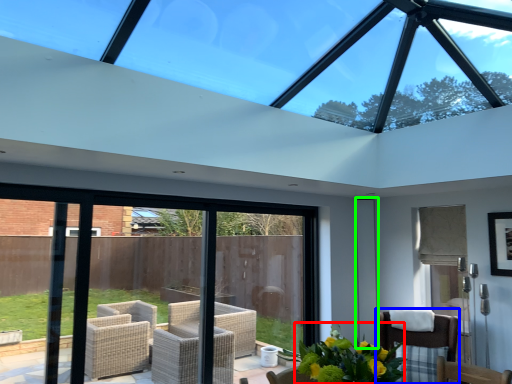
Question: Which is nearer to the floral arrangement (highlighted by a red box)? chair (highlighted by a blue box) or screen door (highlighted by a green box).

Choices:
 (A) chair
 (B) screen door

Answer: (A)